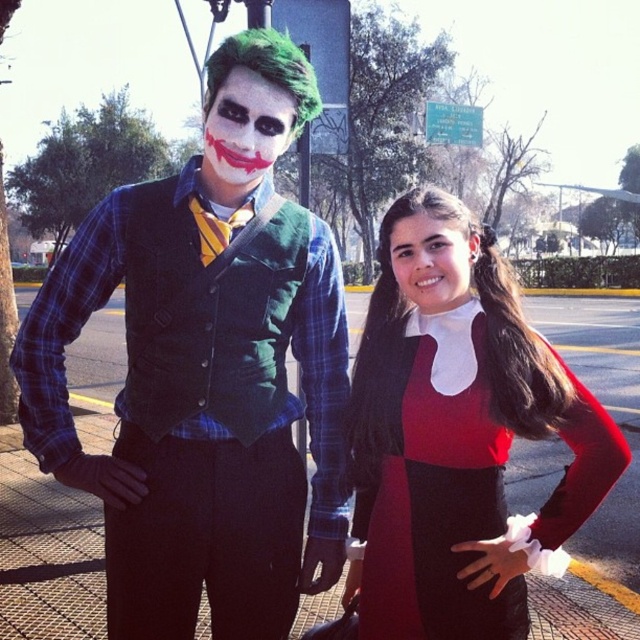
Can you confirm if matte black vest at center is bigger than matte red sweater at center?

Yes.

Based on the photo, who is more distant from viewer, (152, 381) or (547, 401)?

Positioned behind is point (152, 381).

You are a GUI agent. You are given a task and a screenshot of the screen. Output one action in this format:
    pyautogui.click(x=<x>, y=<y>)
    Task: Click on the matte black vest at center
    The height and width of the screenshot is (640, 640).
    Given the screenshot: What is the action you would take?
    pyautogui.click(x=202, y=396)

The image size is (640, 640). In order to click on matte red sweater at center in this screenshot , I will do `click(456, 433)`.

Describe the element at coordinates (456, 433) in the screenshot. I see `matte red sweater at center` at that location.

The image size is (640, 640). Identify the location of matte red sweater at center. (456, 433).

Identify the location of matte red sweater at center. The height and width of the screenshot is (640, 640). (456, 433).

Can you confirm if matte black vest at center is taller than matte red dress at center?

Indeed, matte black vest at center has a greater height compared to matte red dress at center.

What do you see at coordinates (202, 396) in the screenshot? Image resolution: width=640 pixels, height=640 pixels. I see `matte black vest at center` at bounding box center [202, 396].

Which is behind, point (104, 497) or point (449, 588)?

The point (104, 497) is more distant.

Identify the location of matte black vest at center. (202, 396).